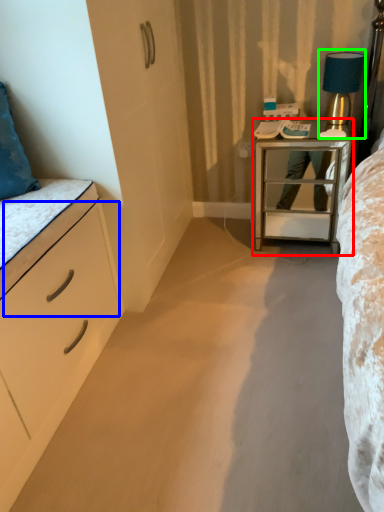
Question: Which is farther away from nightstand (highlighted by a red box)? drawer (highlighted by a blue box) or bedside lamp (highlighted by a green box)?

Choices:
 (A) drawer
 (B) bedside lamp

Answer: (A)